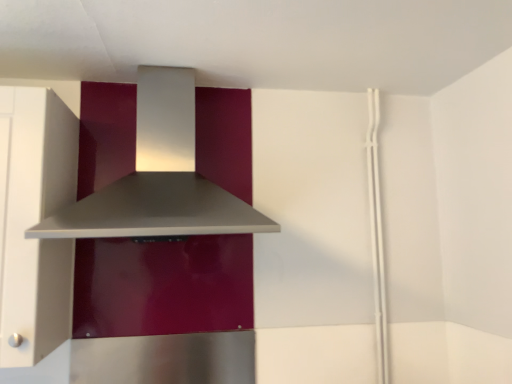
The image size is (512, 384). I want to click on metallic gray range hood at center, so click(154, 211).

Image resolution: width=512 pixels, height=384 pixels. Describe the element at coordinates (154, 211) in the screenshot. I see `metallic gray range hood at center` at that location.

Find the location of a particular element. This screenshot has height=384, width=512. metallic gray range hood at center is located at coordinates (154, 211).